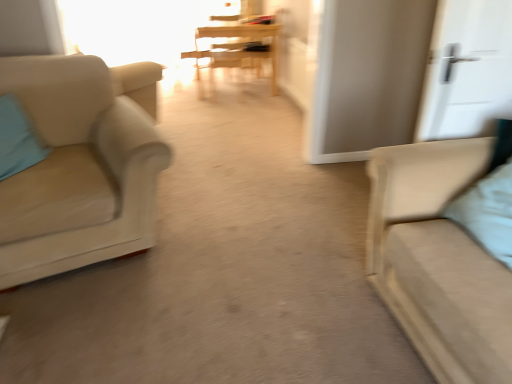
Question: Considering the positions of light blue fabric pillow at left, which appears as the first pillow when viewed from the left, and transparent glass window at upper center in the image, is light blue fabric pillow at left, which appears as the first pillow when viewed from the left, bigger or smaller than transparent glass window at upper center?

Choices:
 (A) small
 (B) big

Answer: (A)

Question: Relative to transparent glass window at upper center, is light blue fabric pillow at left, which ranks as the 1th pillow in back-to-front order, in front or behind?

Choices:
 (A) front
 (B) behind

Answer: (A)

Question: Which object is positioned farthest from the beige fabric chair at left?

Choices:
 (A) matte beige couch at right
 (B) wooden armchair at center
 (C) wooden table at center
 (D) light blue fabric pillow at right, the second pillow from the left
 (E) light blue fabric pillow at left, which is the second pillow in right-to-left order

Answer: (C)

Question: Considering the real-world distances, which object is farthest from the matte beige couch at right?

Choices:
 (A) light blue fabric pillow at left, which ranks as the 1th pillow in back-to-front order
 (B) light blue fabric pillow at right, the 1th pillow from the front
 (C) wooden table at center
 (D) transparent glass window at upper center
 (E) beige fabric chair at left

Answer: (D)